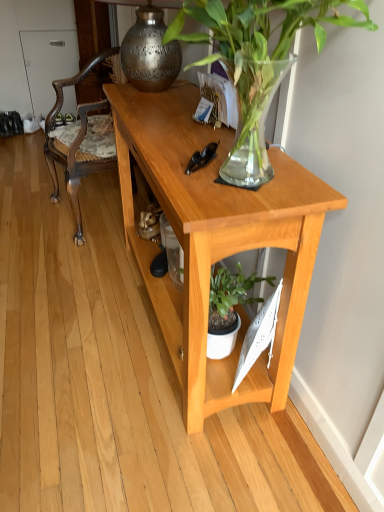
The height and width of the screenshot is (512, 384). What are the coordinates of `empty space that is in between polished brass lamp at upper center and green glossy plant at upper center` in the screenshot? It's located at (167, 122).